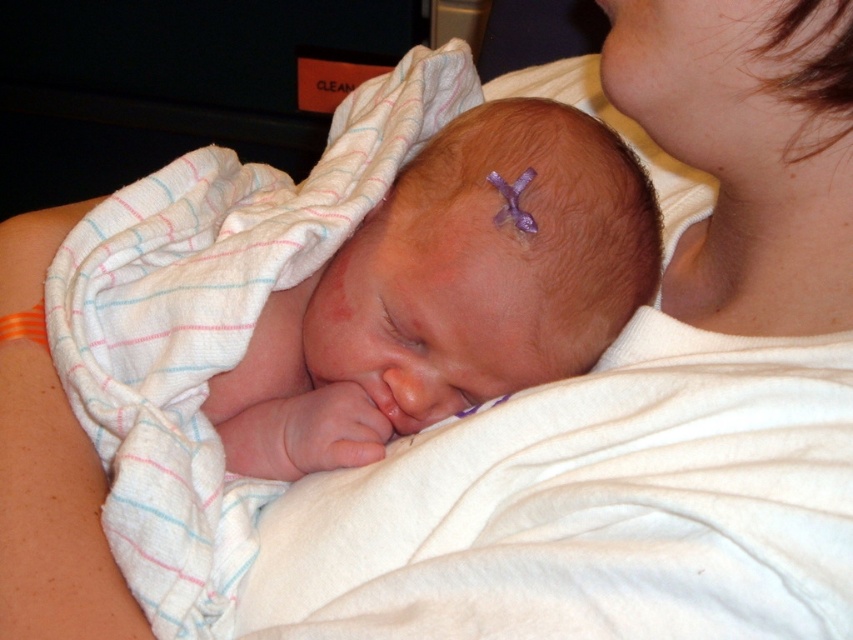
You are a photographer taking a closeup shot of the smooth skin newborn at center and the orange fabric at lower left. Which object should you focus on first if you want to capture both in one frame without moving the camera?

You should focus on the smooth skin newborn at center first because it is positioned to the right of the orange fabric at lower left, so adjusting focus from left to right would naturally include both in the frame.

Based on the scene described, which object is taller between the smooth skin newborn at center and the orange fabric at lower left?

The orange fabric at lower left is taller than the smooth skin newborn at center.

What is the exact location of the smooth skin newborn at center in the image?

The smooth skin newborn at center is located at point (448, 292).